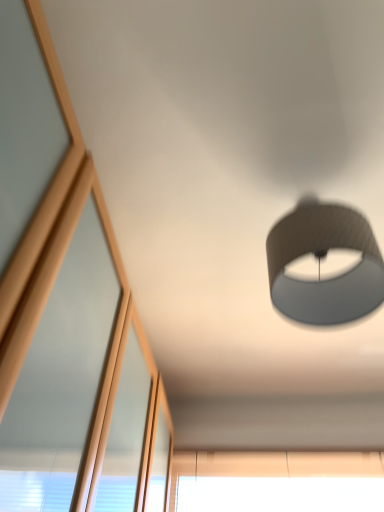
Question: Considering the relative sizes of beige fabric window at lower center and matte gray lampshade at upper right in the image provided, is beige fabric window at lower center bigger than matte gray lampshade at upper right?

Choices:
 (A) yes
 (B) no

Answer: (B)

Question: Does beige fabric window at lower center have a lesser height compared to matte gray lampshade at upper right?

Choices:
 (A) yes
 (B) no

Answer: (A)

Question: From the image's perspective, would you say beige fabric window at lower center is positioned over matte gray lampshade at upper right?

Choices:
 (A) no
 (B) yes

Answer: (A)

Question: Is beige fabric window at lower center facing towards matte gray lampshade at upper right?

Choices:
 (A) yes
 (B) no

Answer: (A)

Question: Is beige fabric window at lower center smaller than matte gray lampshade at upper right?

Choices:
 (A) no
 (B) yes

Answer: (B)

Question: Considering the relative sizes of beige fabric window at lower center and matte gray lampshade at upper right in the image provided, is beige fabric window at lower center thinner than matte gray lampshade at upper right?

Choices:
 (A) no
 (B) yes

Answer: (B)

Question: Considering the relative sizes of matte gray lampshade at upper right and beige fabric window at lower center in the image provided, is matte gray lampshade at upper right smaller than beige fabric window at lower center?

Choices:
 (A) yes
 (B) no

Answer: (B)

Question: From the image's perspective, is matte gray lampshade at upper right over beige fabric window at lower center?

Choices:
 (A) no
 (B) yes

Answer: (B)

Question: Is matte gray lampshade at upper right not within beige fabric window at lower center?

Choices:
 (A) no
 (B) yes

Answer: (B)

Question: Is matte gray lampshade at upper right far from beige fabric window at lower center?

Choices:
 (A) yes
 (B) no

Answer: (A)

Question: Is the depth of matte gray lampshade at upper right greater than that of beige fabric window at lower center?

Choices:
 (A) no
 (B) yes

Answer: (A)

Question: Can you confirm if matte gray lampshade at upper right is bigger than beige fabric window at lower center?

Choices:
 (A) yes
 (B) no

Answer: (A)

Question: In terms of width, does beige fabric window at lower center look wider or thinner when compared to matte gray lampshade at upper right?

Choices:
 (A) wide
 (B) thin

Answer: (B)